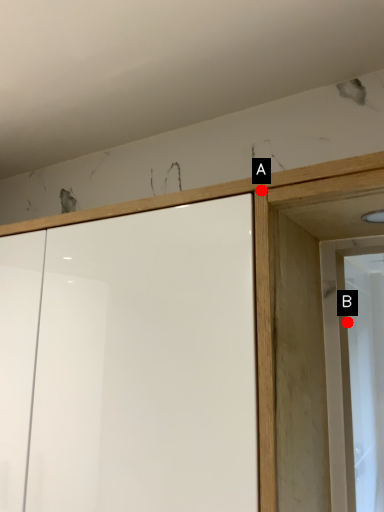
Question: Two points are circled on the image, labeled by A and B beside each circle. Which point is closer to the camera taking this photo?

Choices:
 (A) A is closer
 (B) B is closer

Answer: (A)